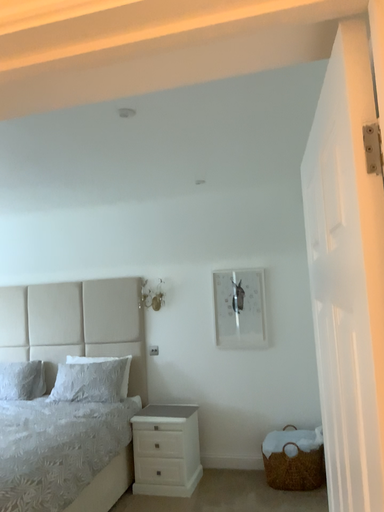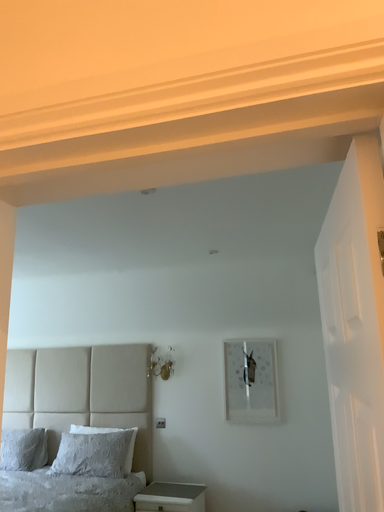
Question: Which way did the camera rotate in the video?

Choices:
 (A) rotated upward
 (B) rotated downward

Answer: (A)